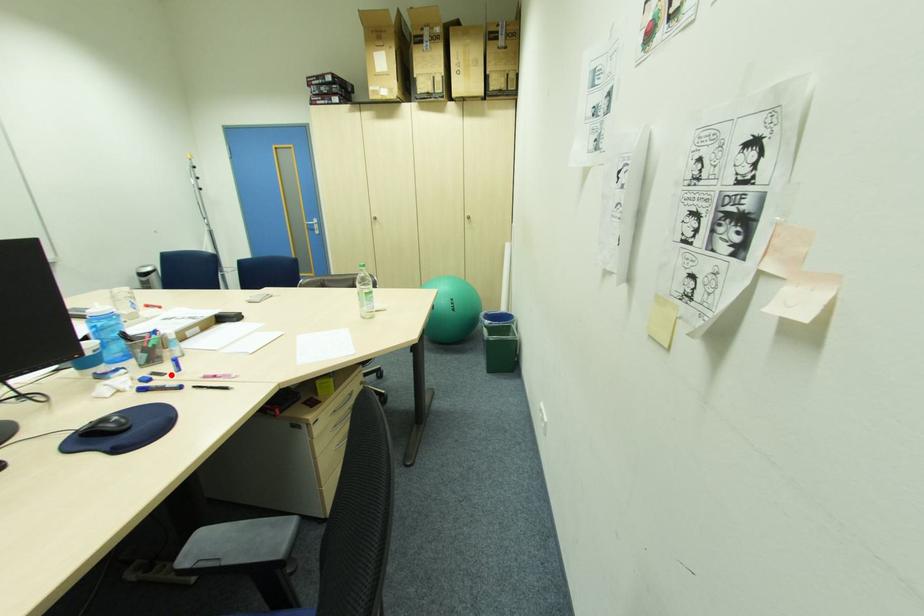
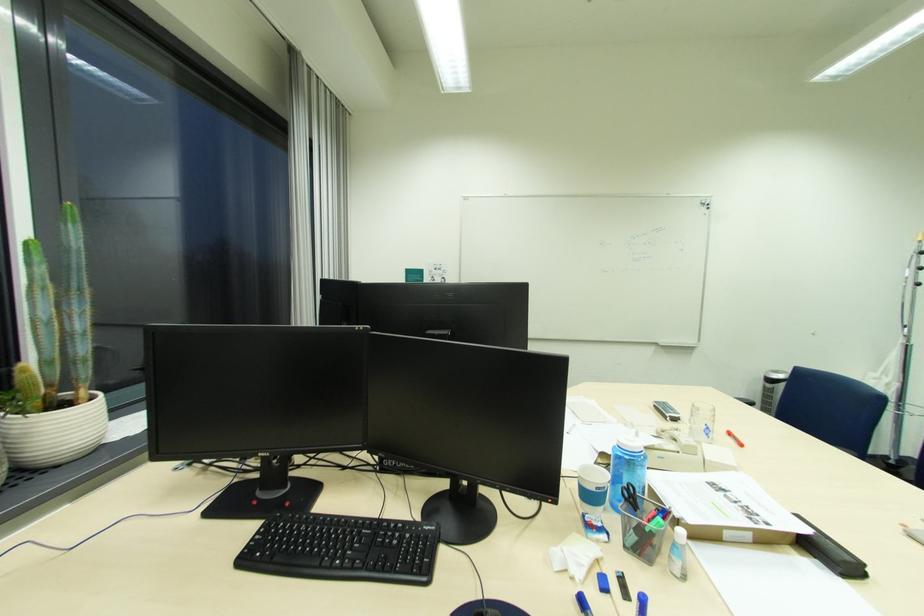
The point at the highlighted location is marked in the first image. Where is the corresponding point in the second image?

(636, 601)